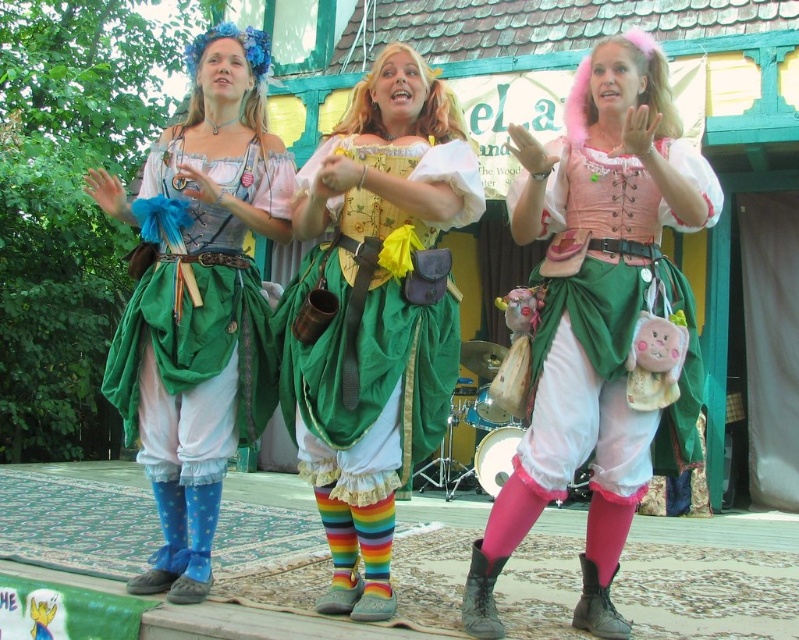
Question: Can you confirm if matte yellow corset at center is thinner than matte blue fabric dress at left?

Choices:
 (A) yes
 (B) no

Answer: (A)

Question: Observing the image, what is the correct spatial positioning of pink matte skirt at center in reference to matte blue fabric dress at left?

Choices:
 (A) right
 (B) left

Answer: (A)

Question: Which point is farther from the camera taking this photo?

Choices:
 (A) (633, 51)
 (B) (259, 330)
 (C) (342, 380)

Answer: (B)

Question: Which point is closer to the camera?

Choices:
 (A) (157, 259)
 (B) (582, 305)
 (C) (400, 88)

Answer: (B)

Question: Which of the following is the closest to the observer?

Choices:
 (A) pink matte skirt at center
 (B) matte yellow corset at center

Answer: (B)

Question: Where is matte yellow corset at center located in relation to matte blue fabric dress at left in the image?

Choices:
 (A) below
 (B) above

Answer: (A)